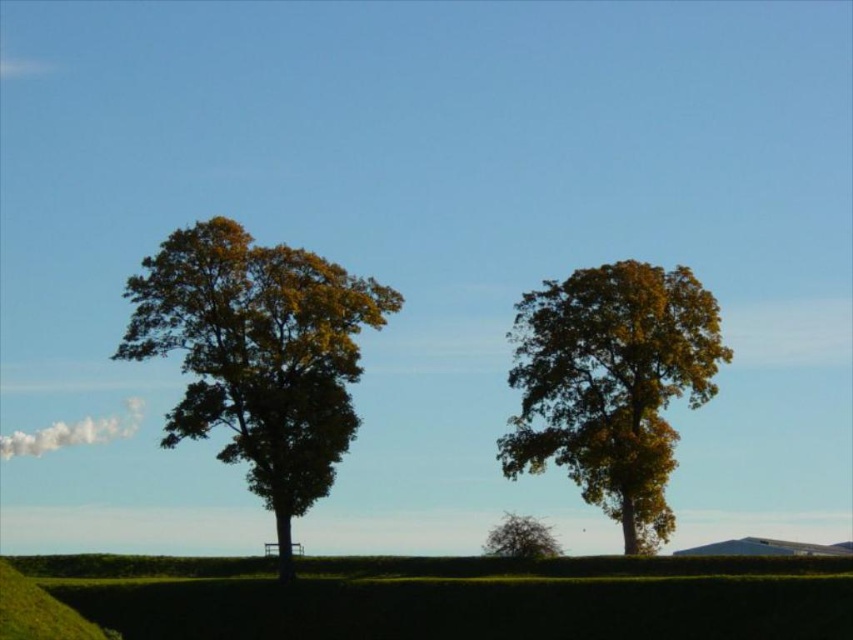
You are standing at the base of the green leafy tree at left and want to walk towards the green grassy hillside at lower center. Which direction should you head?

You should head to the right because the green grassy hillside at lower center is located to the left of the green leafy tree at left, so moving right from the tree will lead you towards the hillside.